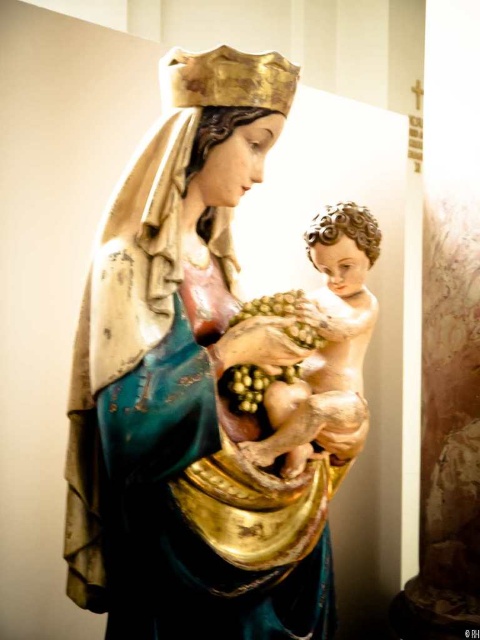
You are a visitor standing in front of the matte gold statue at center. You want to take a photo of it without getting too close. What is the minimum distance you should maintain to ensure you can capture the entire statue in your camera frame?

The minimum distance you should maintain is 4.60 feet, as that is the current distance between you and the matte gold statue at center.